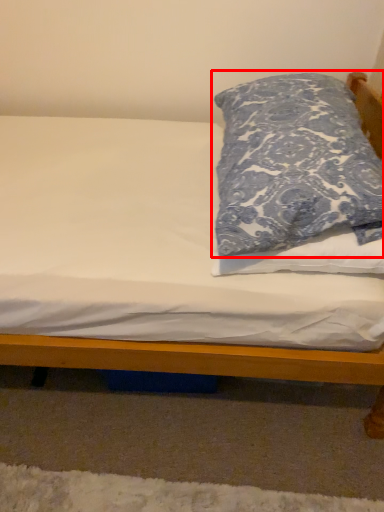
Question: Considering the relative positions of pillow (annotated by the red box) and bed in the image provided, where is pillow (annotated by the red box) located with respect to the staircase?

Choices:
 (A) right
 (B) left

Answer: (A)